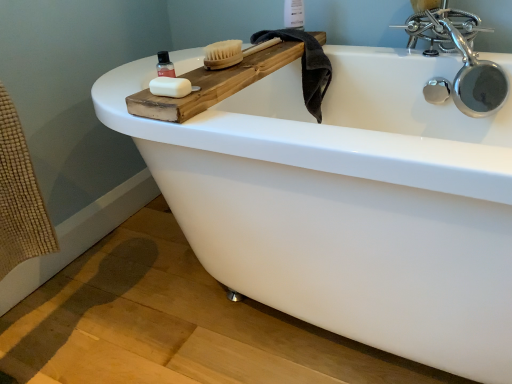
Question: Is the depth of translucent plastic bottle at upper left greater than that of white matte soap at upper left?

Choices:
 (A) no
 (B) yes

Answer: (B)

Question: Is translucent plastic bottle at upper left facing away from white matte soap at upper left?

Choices:
 (A) yes
 (B) no

Answer: (B)

Question: Considering the relative positions of translucent plastic bottle at upper left and white matte soap at upper left in the image provided, is translucent plastic bottle at upper left to the left of white matte soap at upper left from the viewer's perspective?

Choices:
 (A) yes
 (B) no

Answer: (A)

Question: Considering the relative sizes of translucent plastic bottle at upper left and white matte soap at upper left in the image provided, is translucent plastic bottle at upper left bigger than white matte soap at upper left?

Choices:
 (A) yes
 (B) no

Answer: (B)

Question: Can you confirm if translucent plastic bottle at upper left is shorter than white matte soap at upper left?

Choices:
 (A) yes
 (B) no

Answer: (B)

Question: From the image's perspective, is dark gray towel at upper right located above or below polished chrome faucet at upper right?

Choices:
 (A) below
 (B) above

Answer: (A)

Question: Is dark gray towel at upper right bigger or smaller than polished chrome faucet at upper right?

Choices:
 (A) big
 (B) small

Answer: (B)

Question: From a real-world perspective, relative to polished chrome faucet at upper right, is dark gray towel at upper right vertically above or below?

Choices:
 (A) below
 (B) above

Answer: (A)

Question: Is point (283, 31) positioned closer to the camera than point (465, 114)?

Choices:
 (A) farther
 (B) closer

Answer: (A)

Question: In terms of width, does white matte soap at upper left look wider or thinner when compared to polished chrome faucet at upper right?

Choices:
 (A) thin
 (B) wide

Answer: (A)

Question: From the image's perspective, relative to polished chrome faucet at upper right, is white matte soap at upper left above or below?

Choices:
 (A) below
 (B) above

Answer: (A)

Question: In the image, is white matte soap at upper left positioned in front of or behind polished chrome faucet at upper right?

Choices:
 (A) front
 (B) behind

Answer: (A)

Question: Considering the positions of point (189, 84) and point (466, 104), is point (189, 84) closer or farther from the camera than point (466, 104)?

Choices:
 (A) closer
 (B) farther

Answer: (A)

Question: From a real-world perspective, is translucent plastic bottle at upper left positioned above or below white plastic bottle at upper center?

Choices:
 (A) below
 (B) above

Answer: (A)

Question: Does point (159, 69) appear closer or farther from the camera than point (301, 3)?

Choices:
 (A) closer
 (B) farther

Answer: (A)